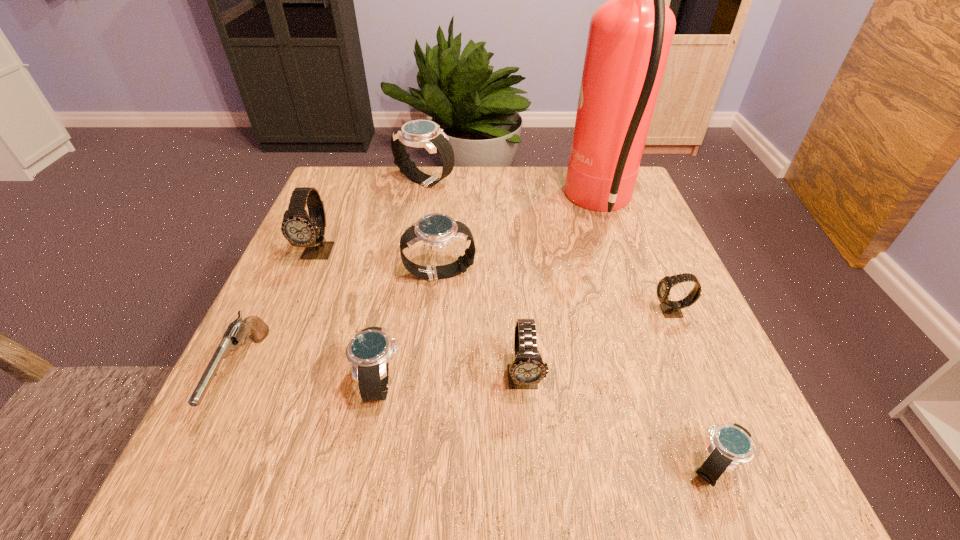
Identify the location of the tallest object. This screenshot has width=960, height=540. (629, 39).

The height and width of the screenshot is (540, 960). I want to click on red fire extinguisher, so click(x=629, y=39).

Locate an element on the screen. the biggest silver watch is located at coordinates (418, 133).

Where is `the farthest silver watch`? the farthest silver watch is located at coordinates (418, 133).

Locate an element on the screen. The width and height of the screenshot is (960, 540). the leftmost gray watch is located at coordinates [x=300, y=229].

Where is `the biggest gray watch`? This screenshot has height=540, width=960. the biggest gray watch is located at coordinates (300, 229).

You are a GUI agent. You are given a task and a screenshot of the screen. Output one action in this format:
    pyautogui.click(x=<x>, y=<y>)
    Task: Click on the third smallest silver watch
    The image size is (960, 540).
    Given the screenshot: What is the action you would take?
    pyautogui.click(x=436, y=231)

Locate an element on the screen. the fourth object from right to left is located at coordinates (527, 370).

Where is `the nearest gray watch`? This screenshot has width=960, height=540. the nearest gray watch is located at coordinates (527, 370).

At what (x,y) coordinates should I click in order to perform the action: click on the third biggest silver watch. Please return your answer as a coordinate pair (x, y). This screenshot has width=960, height=540. Looking at the image, I should click on (369, 351).